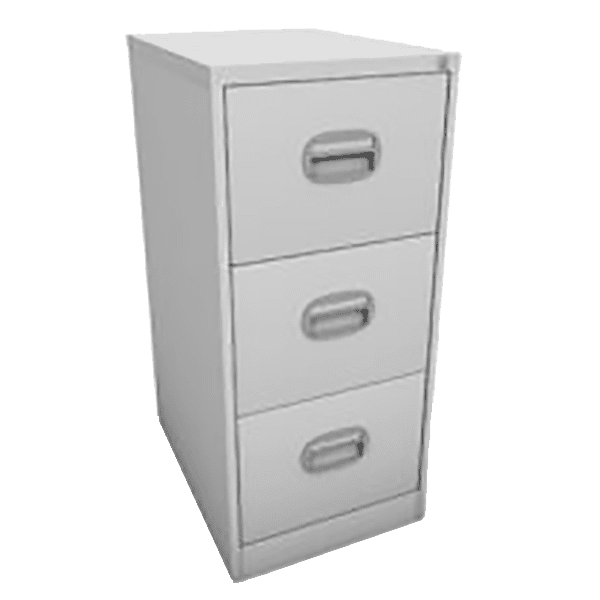
Where is `bottom drawer`? The width and height of the screenshot is (600, 600). bottom drawer is located at coordinates (251, 530).